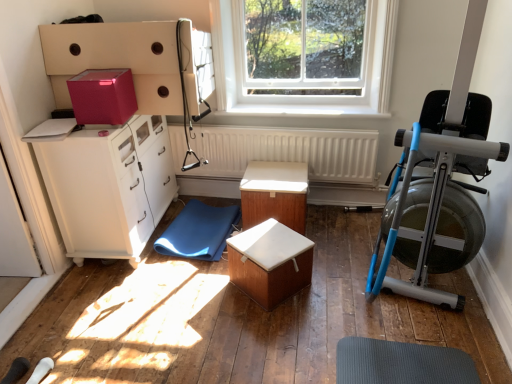
Where is `free space on the front side of wooden box at center, marked as the second table in a back-to-front arrangement`? The image size is (512, 384). free space on the front side of wooden box at center, marked as the second table in a back-to-front arrangement is located at coordinates (271, 332).